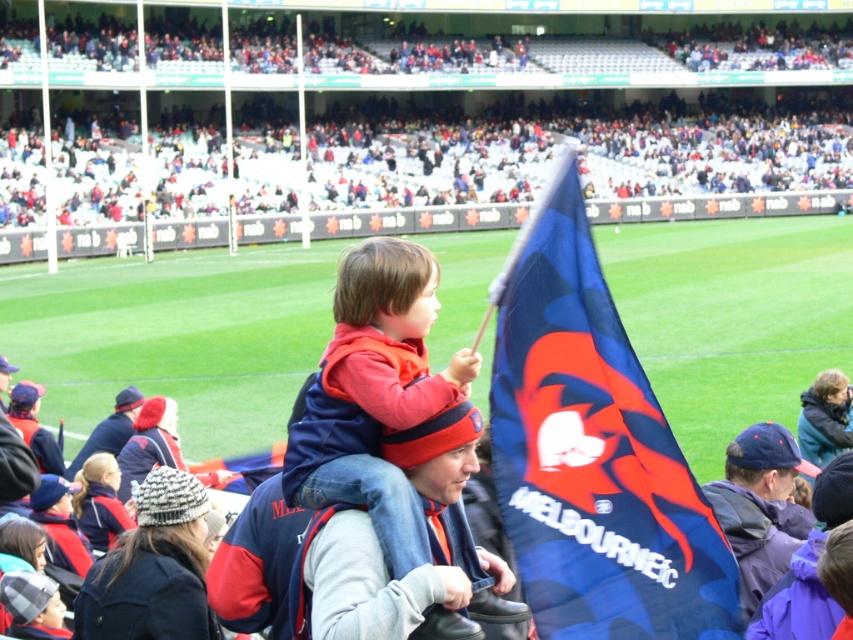
Which is behind, point (422, 522) or point (128, 387)?

The point (128, 387) is behind.

Can you confirm if red fleece jacket at center is wider than dark blue jacket at center?

Yes.

Does point (467, 602) lie behind point (136, 401)?

No, (467, 602) is in front of (136, 401).

Image resolution: width=853 pixels, height=640 pixels. Find the location of `red fleece jacket at center`. red fleece jacket at center is located at coordinates (374, 396).

Is blue fabric flag at center to the right of dark blue jacket at center from the viewer's perspective?

Yes, blue fabric flag at center is to the right of dark blue jacket at center.

Which is behind, point (567, 376) or point (96, 442)?

The point (96, 442) is more distant.

Describe the element at coordinates (593, 452) in the screenshot. The image size is (853, 640). I see `blue fabric flag at center` at that location.

Where is `blue fabric flag at center`? blue fabric flag at center is located at coordinates (593, 452).

Can you confirm if blue fabric flag at center is positioned below red fleece jacket at center?

Incorrect, blue fabric flag at center is not positioned below red fleece jacket at center.

Does blue fabric flag at center appear over red fleece jacket at center?

Indeed, blue fabric flag at center is positioned over red fleece jacket at center.

Find the location of `blue fabric flag at center`. blue fabric flag at center is located at coordinates (593, 452).

The width and height of the screenshot is (853, 640). In order to click on blue fabric flag at center in this screenshot , I will do `click(593, 452)`.